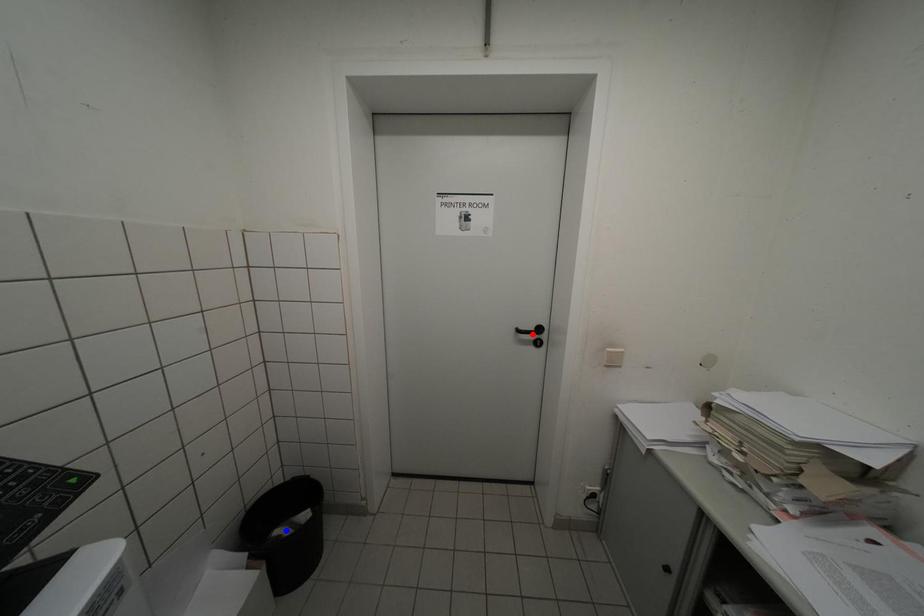
Question: Two points are marked on the image. Which point is closer to the camera?

Choices:
 (A) Blue point is closer.
 (B) Red point is closer.

Answer: (A)